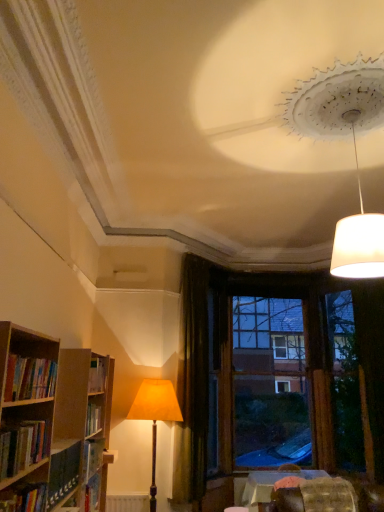
Question: Considering the relative positions of textured fabric swivel chair at lower right and brown wooden window frame at center in the image provided, is textured fabric swivel chair at lower right behind brown wooden window frame at center?

Choices:
 (A) no
 (B) yes

Answer: (A)

Question: Is textured fabric swivel chair at lower right next to brown wooden window frame at center and touching it?

Choices:
 (A) no
 (B) yes

Answer: (A)

Question: Does textured fabric swivel chair at lower right have a smaller size compared to brown wooden window frame at center?

Choices:
 (A) yes
 (B) no

Answer: (A)

Question: Does textured fabric swivel chair at lower right have a greater width compared to brown wooden window frame at center?

Choices:
 (A) yes
 (B) no

Answer: (A)

Question: Is textured fabric swivel chair at lower right oriented away from brown wooden window frame at center?

Choices:
 (A) yes
 (B) no

Answer: (A)

Question: Considering the positions of hardcover books at left, the first book from the top, and white matte lampshade at upper right, the 1th lamp positioned from the right, in the image, is hardcover books at left, the first book from the top, wider or thinner than white matte lampshade at upper right, the 1th lamp positioned from the right,?

Choices:
 (A) wide
 (B) thin

Answer: (B)

Question: From their relative heights in the image, would you say hardcover books at left, the first book from the top, is taller or shorter than white matte lampshade at upper right, which appears as the 1th lamp when viewed from the top?

Choices:
 (A) short
 (B) tall

Answer: (A)

Question: Relative to white matte lampshade at upper right, the second lamp viewed from the left, is hardcover books at left, the first book from the top, in front or behind?

Choices:
 (A) front
 (B) behind

Answer: (A)

Question: Would you say hardcover books at left, the first book from the top, is to the left or to the right of white matte lampshade at upper right, the 1th lamp when ordered from front to back, in the picture?

Choices:
 (A) left
 (B) right

Answer: (A)

Question: Is dark velvet curtain at center wider or thinner than hardcover book at lower left, which ranks as the 1th book in bottom-to-top order?

Choices:
 (A) wide
 (B) thin

Answer: (B)

Question: Looking at the image, does dark velvet curtain at center seem bigger or smaller compared to hardcover book at lower left, positioned as the third book in top-to-bottom order?

Choices:
 (A) small
 (B) big

Answer: (B)

Question: Based on their positions, is dark velvet curtain at center located to the left or right of hardcover book at lower left, positioned as the third book in top-to-bottom order?

Choices:
 (A) right
 (B) left

Answer: (A)

Question: From the image's perspective, relative to hardcover book at lower left, positioned as the third book in top-to-bottom order, is dark velvet curtain at center above or below?

Choices:
 (A) above
 (B) below

Answer: (B)

Question: Is point (152, 454) positioned closer to the camera than point (19, 394)?

Choices:
 (A) farther
 (B) closer

Answer: (A)

Question: In the image, is matte orange fabric lampshade at center, marked as the 1th lamp in a left-to-right arrangement, positioned in front of or behind hardcover books at left, the first book from the top?

Choices:
 (A) behind
 (B) front

Answer: (A)